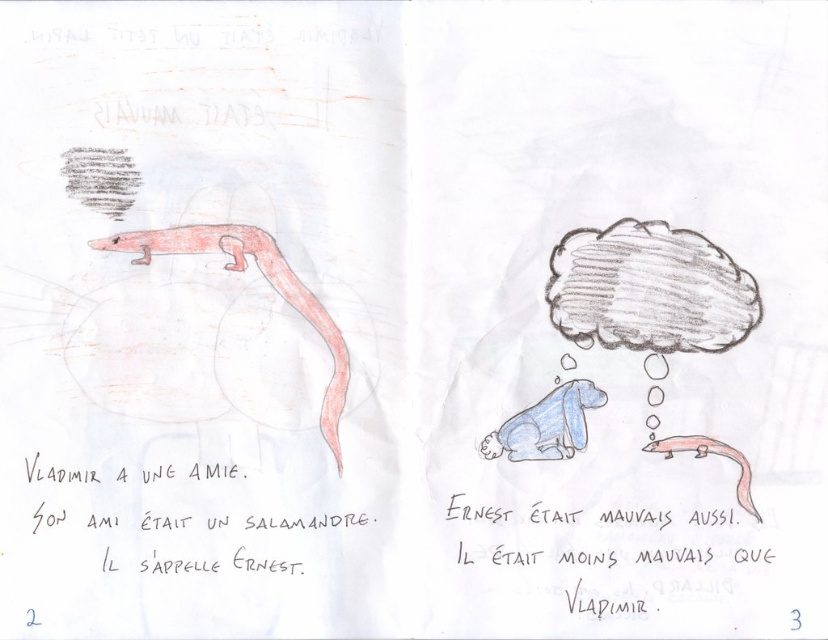
Is gray textured cloud at upper center shorter than blue paper dog at center?

In fact, gray textured cloud at upper center may be taller than blue paper dog at center.

Who is positioned more to the left, gray textured cloud at upper center or blue paper dog at center?

blue paper dog at center

Between point (704, 342) and point (561, 408), which one is positioned behind?

The point (704, 342) is more distant.

This screenshot has height=640, width=828. I want to click on gray textured cloud at upper center, so click(648, 289).

Can you confirm if pink matte salamander at center is bigger than blue paper dog at center?

Indeed, pink matte salamander at center has a larger size compared to blue paper dog at center.

Is pink matte salamander at center below blue paper dog at center?

No, pink matte salamander at center is not below blue paper dog at center.

What do you see at coordinates (268, 282) in the screenshot?
I see `pink matte salamander at center` at bounding box center [268, 282].

The height and width of the screenshot is (640, 828). What are the coordinates of `pink matte salamander at center` in the screenshot? It's located at (268, 282).

Measure the distance between gray textured cloud at upper center and camera.

33.37 inches

Is gray textured cloud at upper center closer to the viewer compared to pink matte salamander at center?

No.

I want to click on gray textured cloud at upper center, so click(x=648, y=289).